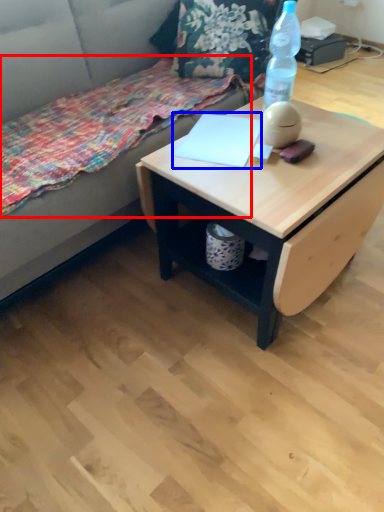
Question: Which point is closer to the camera, blanket (highlighted by a red box) or notepad (highlighted by a blue box)?

Choices:
 (A) blanket
 (B) notepad

Answer: (A)